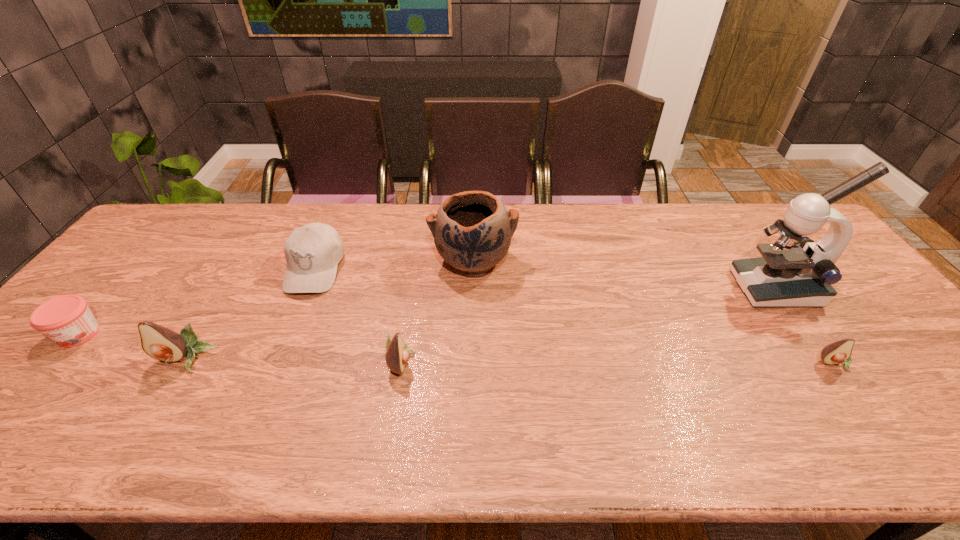
The height and width of the screenshot is (540, 960). Identify the location of vacant region between the second shortest avocado and the rightmost avocado. (618, 362).

Locate an element on the screen. The image size is (960, 540). vacant area between the leftmost avocado and the second avocado from left to right is located at coordinates (294, 361).

This screenshot has width=960, height=540. What are the coordinates of `unoccupied area between the fourth object from left to right and the sixth shortest object` in the screenshot? It's located at (437, 311).

Find the location of a particular element. The height and width of the screenshot is (540, 960). vacant area that lies between the fifth object from left to right and the jam is located at coordinates (276, 298).

Locate an element on the screen. the second closest object to the baseball cap is located at coordinates (397, 355).

Point out which object is positioned as the nearest to the second avocado from right to left. Please provide its 2D coordinates. Your answer should be formatted as a tuple, i.e. [(x, y)], where the tuple contains the x and y coordinates of a point satisfying the conditions above.

[(472, 230)]

The width and height of the screenshot is (960, 540). What are the coordinates of `avocado that is the closest one to the tallest avocado` in the screenshot? It's located at (397, 355).

You are a GUI agent. You are given a task and a screenshot of the screen. Output one action in this format:
    pyautogui.click(x=<x>, y=<y>)
    Task: Click on the avocado that stands as the closest to the third tallest object
    
    Given the screenshot: What is the action you would take?
    pyautogui.click(x=397, y=355)

Locate an element on the screen. This screenshot has height=540, width=960. free space that satisfies the following two spatial constraints: 1. on the front-facing side of the tallest object; 2. on the right side of the baseball cap is located at coordinates (x=306, y=288).